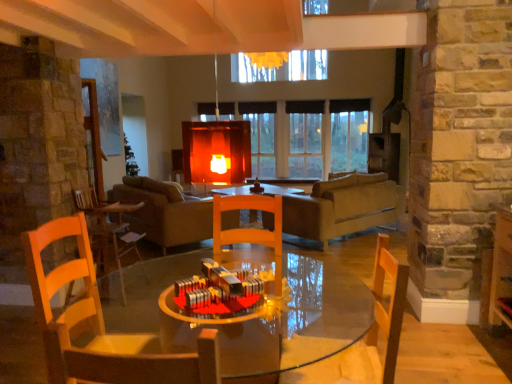
Locate an element on the screen. The image size is (512, 384). leather couch at center is located at coordinates (165, 211).

What is the approximate height of wooden chair at center, placed as the first chair when sorted from right to left?

It is 29.31 inches.

The height and width of the screenshot is (384, 512). What do you see at coordinates (373, 323) in the screenshot? I see `wooden chair at center, placed as the first chair when sorted from right to left` at bounding box center [373, 323].

Identify the location of transparent glass table at center. Image resolution: width=512 pixels, height=384 pixels. (279, 321).

Locate an element on the screen. transparent glass window at center is located at coordinates (304, 136).

Image resolution: width=512 pixels, height=384 pixels. What are the coordinates of `wooden chair at left, arranged as the third chair when viewed from the right` in the screenshot? It's located at (110, 227).

Which is behind, leather couch at center or wooden chair at center, placed as the first chair when sorted from right to left?

leather couch at center is further away from the camera.

From the image's perspective, between leather couch at center and wooden chair at center, placed as the first chair when sorted from right to left, which one is located above?

leather couch at center appears higher in the image.

Are leather couch at center and wooden chair at center, placed as the first chair when sorted from right to left, making contact?

No, leather couch at center is not next to wooden chair at center, placed as the first chair when sorted from right to left.

Is point (205, 200) closer or farther from the camera than point (392, 344)?

Point (205, 200) is farther from the camera than point (392, 344).

Consider the image. Considering the sizes of objects leather couch at center and transparent glass table at center in the image provided, who is bigger, leather couch at center or transparent glass table at center?

leather couch at center.

Is point (180, 213) positioned after point (160, 315)?

That is True.

From a real-world perspective, is leather couch at center positioned under transparent glass table at center based on gravity?

Actually, leather couch at center is physically above transparent glass table at center in the real world.

Is there a large distance between leather couch at center and transparent glass table at center?

leather couch at center is far away from transparent glass table at center.

Is wooden chair at left, acting as the 1th chair starting from the left, facing away from transparent glass table at center?

No, wooden chair at left, acting as the 1th chair starting from the left, is not facing away from transparent glass table at center.

In the scene shown: Can you tell me how much wooden chair at left, arranged as the third chair when viewed from the right, and transparent glass table at center differ in facing direction?

There is a 92.2-degree angle between the facing directions of wooden chair at left, arranged as the third chair when viewed from the right, and transparent glass table at center.

Considering the relative sizes of wooden chair at left, acting as the 1th chair starting from the left, and transparent glass table at center in the image provided, is wooden chair at left, acting as the 1th chair starting from the left, bigger than transparent glass table at center?

No, wooden chair at left, acting as the 1th chair starting from the left, is not bigger than transparent glass table at center.

Which of these two, wooden chair at left, acting as the 1th chair starting from the left, or transparent glass table at center, stands taller?

Standing taller between the two is wooden chair at left, acting as the 1th chair starting from the left.

Which is in front, point (335, 120) or point (378, 211)?

The point (378, 211) is more forward.

Is transparent glass window at center turned away from matte gray couch at center?

No, matte gray couch at center is not at the back of transparent glass window at center.

Is transparent glass window at center taller than matte gray couch at center?

Yes.

Could you tell me if wooden chair at left, arranged as the third chair when viewed from the right, is facing transparent glass window at center?

No, wooden chair at left, arranged as the third chair when viewed from the right, is not aimed at transparent glass window at center.

Can transparent glass window at center be found inside wooden chair at left, which is the 3th chair in front-to-back order?

No, transparent glass window at center is not inside wooden chair at left, which is the 3th chair in front-to-back order.

Is point (102, 210) farther from camera compared to point (322, 116)?

No, (102, 210) is closer to viewer.

From the image's perspective, which is above, wooden chair at left, acting as the 1th chair starting from the left, or transparent glass window at center?

transparent glass window at center, from the image's perspective.

From a real-world perspective, is transparent glass window at center positioned under wooden chair at center, positioned as the 1th chair in front-to-back order, based on gravity?

No, from a real-world perspective, transparent glass window at center is not below wooden chair at center, positioned as the 1th chair in front-to-back order.

Is transparent glass window at center far away from wooden chair at center, the third chair in the back-to-front sequence?

Yes.

What's the angular difference between transparent glass window at center and wooden chair at center, the third chair in the back-to-front sequence,'s facing directions?

The facing directions of transparent glass window at center and wooden chair at center, the third chair in the back-to-front sequence, are 178 degrees apart.

Does point (290, 106) appear closer or farther from the camera than point (74, 376)?

Clearly, point (290, 106) is more distant from the camera than point (74, 376).

Consider the image. Is wooden chair at center, placed as the first chair when sorted from right to left, next to matte gray couch at center and touching it?

No, wooden chair at center, placed as the first chair when sorted from right to left, is not with matte gray couch at center.

Who is more distant, wooden chair at center, placed as the first chair when sorted from right to left, or matte gray couch at center?

matte gray couch at center is further from the camera.

Image resolution: width=512 pixels, height=384 pixels. In order to click on couch behind the wooden chair at center, acting as the second chair starting from the back in this screenshot , I will do 340,207.

Which point is more forward, (x=380, y=319) or (x=349, y=224)?

The point (x=380, y=319) is more forward.

Identify the location of studio couch above the wooden chair at center, acting as the second chair starting from the back (from the image's perspective). (165, 211).

Image resolution: width=512 pixels, height=384 pixels. Find the location of `studio couch that appears behind the transparent glass table at center`. studio couch that appears behind the transparent glass table at center is located at coordinates (165, 211).

Looking at the image, which one is located further to transparent glass window at center, matte gray couch at center or transparent glass table at center?

transparent glass table at center is further to transparent glass window at center.

Looking at the image, which one is located further to transparent glass table at center, wooden chair at center, placed as the second chair when sorted from left to right, or leather couch at center?

The object further to transparent glass table at center is leather couch at center.

Which object lies nearer to the anchor point matte gray couch at center, wooden chair at center, which ranks as the second chair in right-to-left order, or transparent glass table at center?

transparent glass table at center.

When comparing their distances from wooden chair at left, arranged as the third chair when viewed from the right, does leather couch at center or matte gray couch at center seem closer?

Based on the image, leather couch at center appears to be nearer to wooden chair at left, arranged as the third chair when viewed from the right.

Considering their positions, is matte gray couch at center positioned closer to wooden chair at center, the third chair in the back-to-front sequence, than transparent glass table at center?

The object closer to wooden chair at center, the third chair in the back-to-front sequence, is transparent glass table at center.

Which object lies further to the anchor point wooden chair at center, which ranks as the second chair in right-to-left order, transparent glass table at center or transparent glass window at center?

Among the two, transparent glass window at center is located further to wooden chair at center, which ranks as the second chair in right-to-left order.

When comparing their distances from matte gray couch at center, does wooden chair at center, placed as the second chair when sorted from left to right, or transparent glass window at center seem closer?

transparent glass window at center is positioned closer to the anchor matte gray couch at center.

Looking at this image, from the image, which object appears to be nearer to matte gray couch at center, transparent glass table at center or leather couch at center?

Based on the image, transparent glass table at center appears to be nearer to matte gray couch at center.

Find the location of a particular element. studio couch between transparent glass table at center and matte gray couch at center along the z-axis is located at coordinates (165, 211).

Find the location of a particular element. The width and height of the screenshot is (512, 384). round table located between wooden chair at center, positioned as the 1th chair in front-to-back order, and wooden chair at left, acting as the 1th chair starting from the left, in the depth direction is located at coordinates (279, 321).

Image resolution: width=512 pixels, height=384 pixels. In order to click on studio couch between wooden chair at center, which appears as the 3th chair when viewed from the left, and matte gray couch at center, along the z-axis in this screenshot , I will do `click(165, 211)`.

At what (x,y) coordinates should I click in order to perform the action: click on round table between wooden chair at center, which ranks as the second chair in right-to-left order, and leather couch at center in the front-back direction. Please return your answer as a coordinate pair (x, y). Looking at the image, I should click on (279, 321).